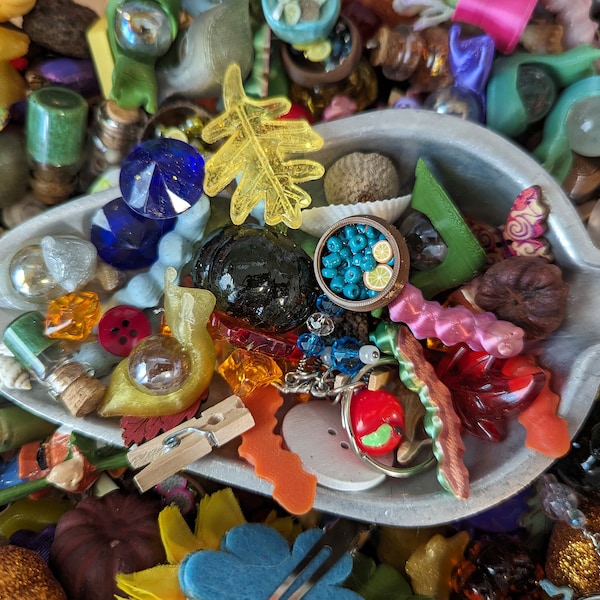
Where is `corks`? This screenshot has width=600, height=600. corks is located at coordinates (121, 115), (48, 195), (80, 392), (383, 56).